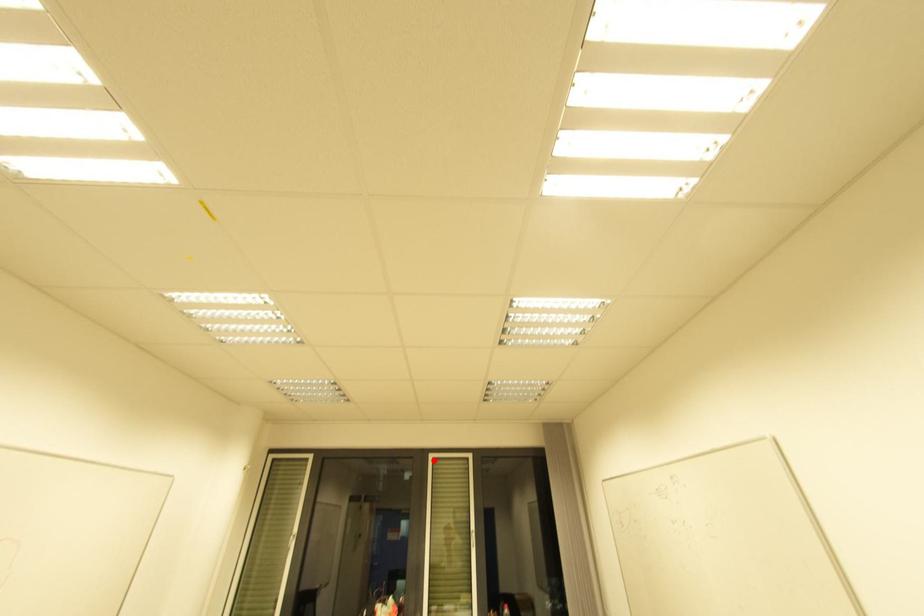
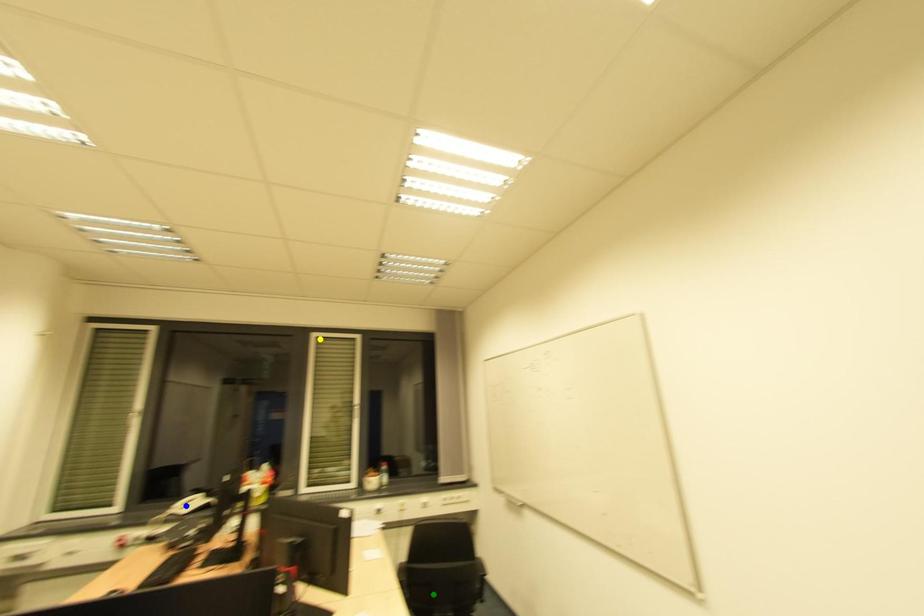
Question: I am providing you with two images of the same scene from different viewpoints. A red point is marked on the first image. You are given multiple points on the second image. Which mark in image 2 goes with the point in image 1?

Choices:
 (A) green point
 (B) blue point
 (C) yellow point

Answer: (C)